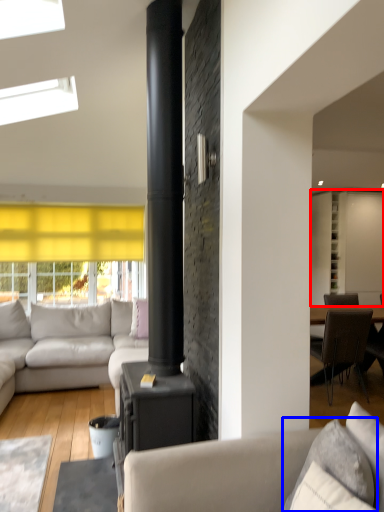
Question: Which point is closer to the camera, cabinetry (highlighted by a red box) or pillow (highlighted by a blue box)?

Choices:
 (A) cabinetry
 (B) pillow

Answer: (B)